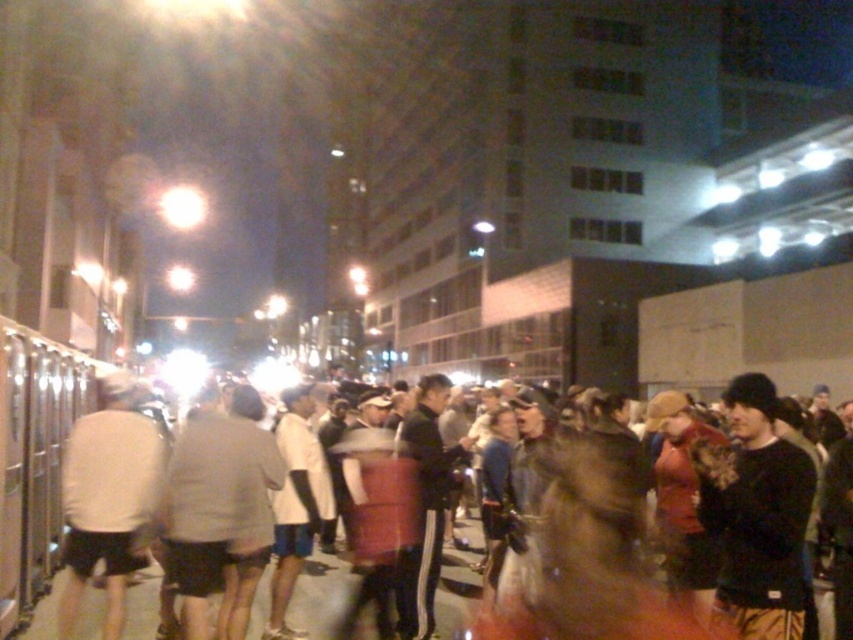
Question: Among these points, which one is farthest from the camera?

Choices:
 (A) (128, 566)
 (B) (804, 509)

Answer: (A)

Question: Is white matte shirt at center above dark gray sweatshirt at center?

Choices:
 (A) yes
 (B) no

Answer: (A)

Question: Which object appears closest to the camera in this image?

Choices:
 (A) white matte shirt at center
 (B) dark gray sweatshirt at center

Answer: (B)

Question: Does white matte shirt at center have a lesser width compared to dark gray sweatshirt at center?

Choices:
 (A) no
 (B) yes

Answer: (B)

Question: Does white matte shirt at center appear under dark gray sweatshirt at center?

Choices:
 (A) no
 (B) yes

Answer: (A)